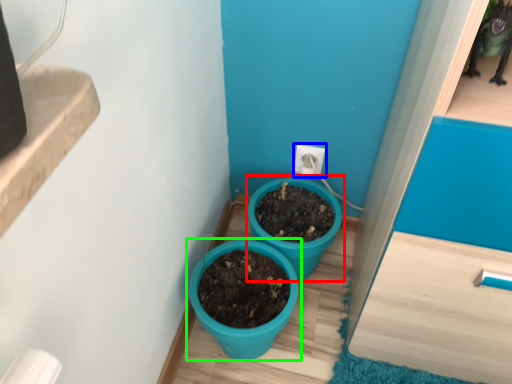
Question: Which is farther away from flowerpot (highlighted by a red box)? electric outlet (highlighted by a blue box) or flowerpot (highlighted by a green box)?

Choices:
 (A) electric outlet
 (B) flowerpot

Answer: (A)